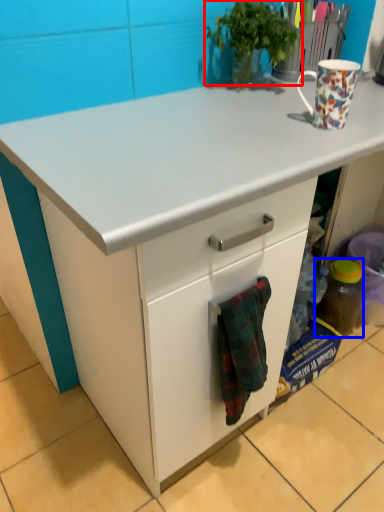
Question: Which object is further to the camera taking this photo, houseplant (highlighted by a red box) or bottle (highlighted by a blue box)?

Choices:
 (A) houseplant
 (B) bottle

Answer: (B)